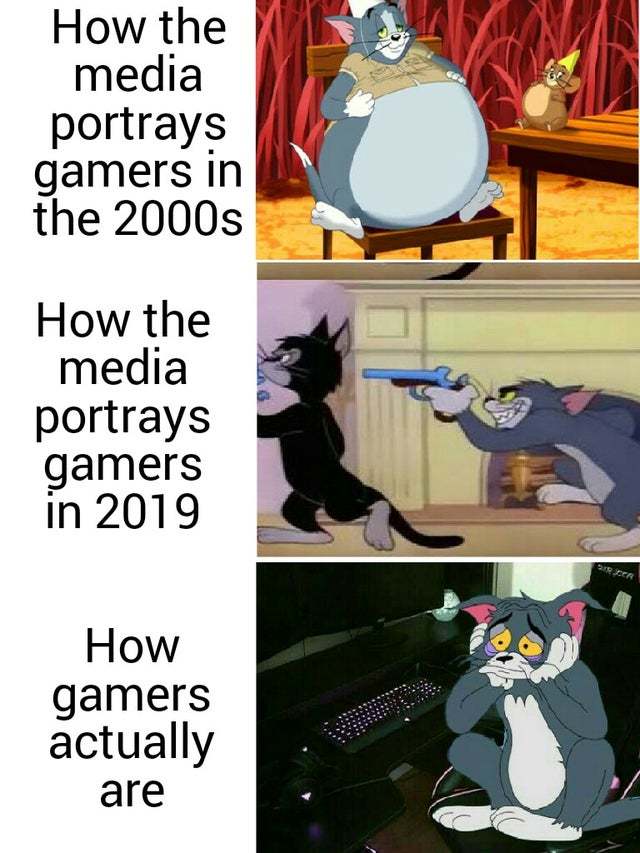
You are a GUI agent. You are given a task and a screenshot of the screen. Output one action in this format:
    pyautogui.click(x=<x>, y=<y>)
    Task: Click on the desk
    The image size is (640, 853).
    Given the screenshot: What is the action you would take?
    pyautogui.click(x=365, y=763)